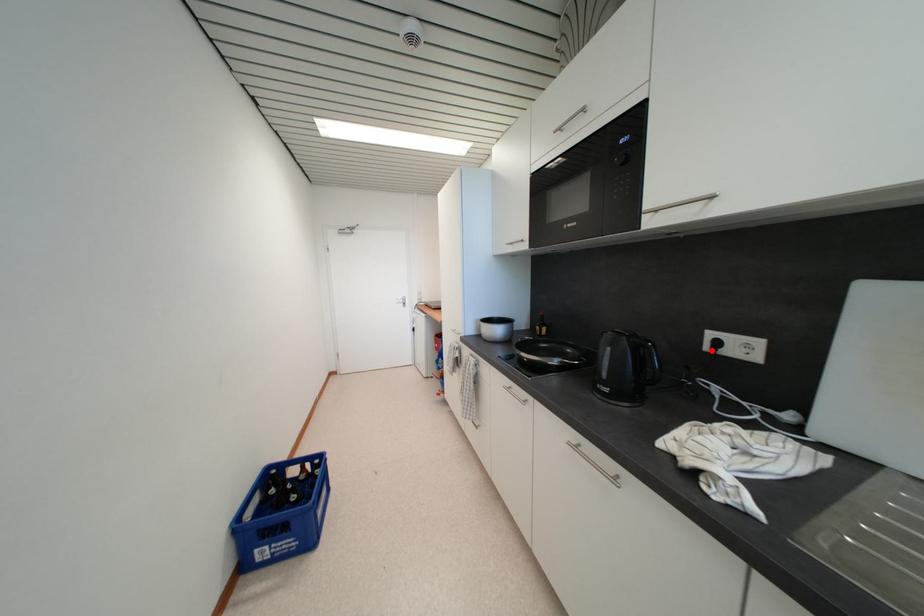
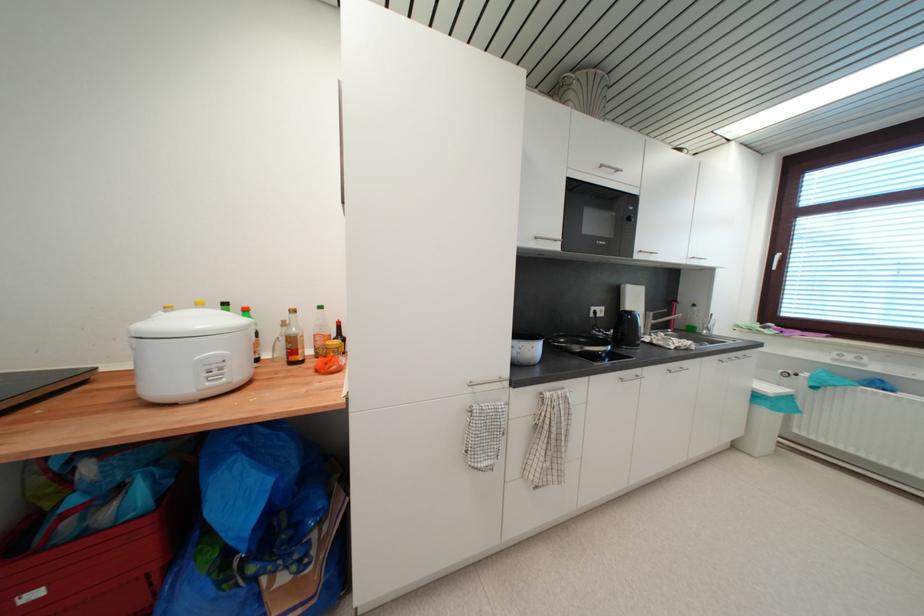
Where in the second image is the point corresponding to the highlighted location from the first image?

(597, 317)